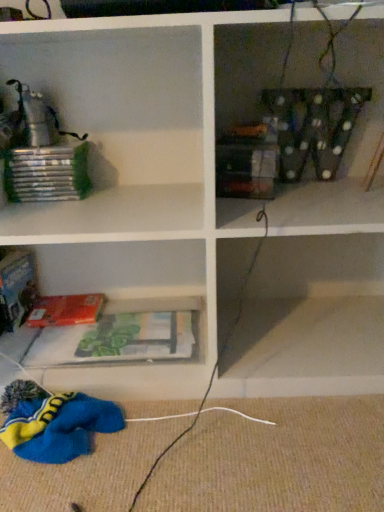
Question: Is matte plastic books at lower center wider or thinner than hardcover book at lower left?

Choices:
 (A) wide
 (B) thin

Answer: (A)

Question: Is matte plastic books at lower center inside or outside of hardcover book at lower left?

Choices:
 (A) inside
 (B) outside

Answer: (B)

Question: From their relative heights in the image, would you say matte plastic books at lower center is taller or shorter than hardcover book at lower left?

Choices:
 (A) short
 (B) tall

Answer: (B)

Question: Looking at the image, does hardcover book at lower left seem bigger or smaller compared to matte plastic books at lower center?

Choices:
 (A) big
 (B) small

Answer: (B)

Question: From their relative heights in the image, would you say hardcover book at lower left is taller or shorter than matte plastic books at lower center?

Choices:
 (A) short
 (B) tall

Answer: (A)

Question: Does point (89, 293) appear closer or farther from the camera than point (117, 321)?

Choices:
 (A) closer
 (B) farther

Answer: (B)

Question: Visually, is hardcover book at lower left positioned to the left or to the right of matte plastic books at lower center?

Choices:
 (A) right
 (B) left

Answer: (B)